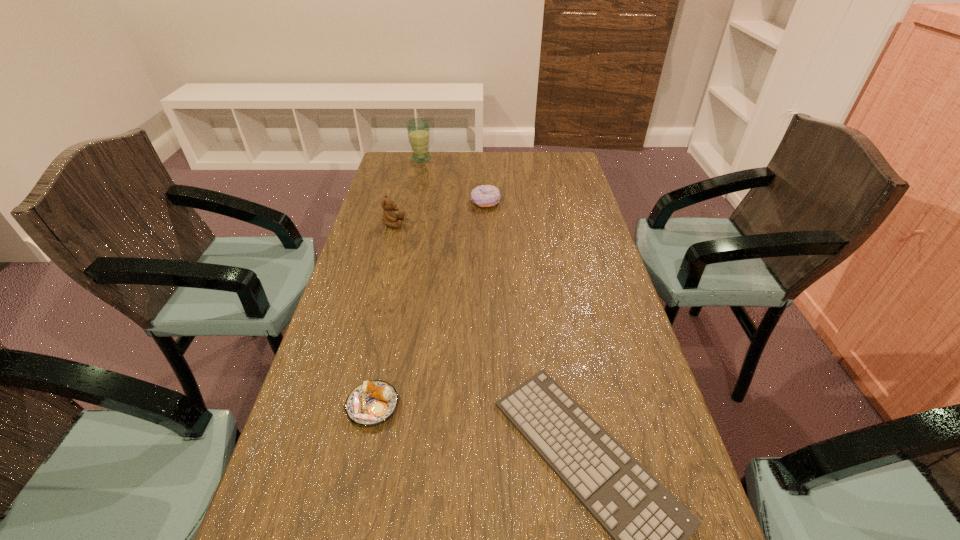
Find the location of a particular element. vacant area situated 0.100m on the right of the pastry is located at coordinates (447, 406).

Find the location of a particular element. Image resolution: width=960 pixels, height=540 pixels. object that is at the far edge is located at coordinates (418, 129).

You are a GUI agent. You are given a task and a screenshot of the screen. Output one action in this format:
    pyautogui.click(x=<x>, y=<y>)
    Task: Click on the glass located in the left edge section of the desktop
    
    Given the screenshot: What is the action you would take?
    pyautogui.click(x=418, y=129)

Locate an element on the screen. teddy bear present at the left edge is located at coordinates (389, 217).

Find the location of a particular element. This screenshot has width=960, height=540. pastry present at the left edge is located at coordinates (372, 402).

You are a GUI agent. You are given a task and a screenshot of the screen. Output one action in this format:
    pyautogui.click(x=<x>, y=<y>)
    Task: Click on the object at the far left corner
    This screenshot has height=540, width=960.
    Given the screenshot: What is the action you would take?
    pyautogui.click(x=418, y=129)

Where is `free space at the far edge`? free space at the far edge is located at coordinates (527, 161).

Identify the location of blank space at the left edge of the desktop. (413, 232).

Where is `vacant space at the right edge of the desktop`? The width and height of the screenshot is (960, 540). vacant space at the right edge of the desktop is located at coordinates (650, 461).

This screenshot has height=540, width=960. I want to click on vacant space at the far right corner, so click(559, 164).